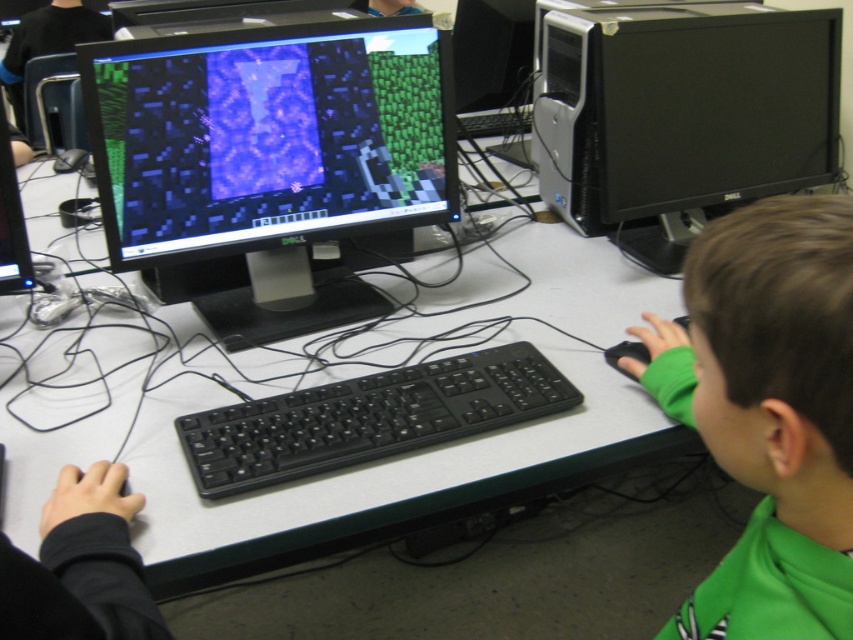
Which of these two, green fleece at lower right or black plastic keyboard at center, stands taller?

With more height is green fleece at lower right.

In the scene shown: Measure the distance between green fleece at lower right and camera.

green fleece at lower right and camera are 18.46 inches apart.

Does point (784, 362) come behind point (283, 401)?

No, it is in front of (283, 401).

Identify the location of green fleece at lower right. The image size is (853, 640). (769, 412).

Who is higher up, white plastic table at center or green fleece at lower right?

white plastic table at center

Does white plastic table at center appear under green fleece at lower right?

Incorrect, white plastic table at center is not positioned below green fleece at lower right.

The width and height of the screenshot is (853, 640). What do you see at coordinates (323, 380) in the screenshot? I see `white plastic table at center` at bounding box center [323, 380].

The height and width of the screenshot is (640, 853). Identify the location of white plastic table at center. (323, 380).

How much distance is there between black glossy monitor at center and green fleece at lower right?

black glossy monitor at center and green fleece at lower right are 30.76 inches apart.

Does black glossy monitor at center appear over green fleece at lower right?

Indeed, black glossy monitor at center is positioned over green fleece at lower right.

Identify the location of black glossy monitor at center. The width and height of the screenshot is (853, 640). (271, 156).

I want to click on black glossy monitor at center, so click(271, 156).